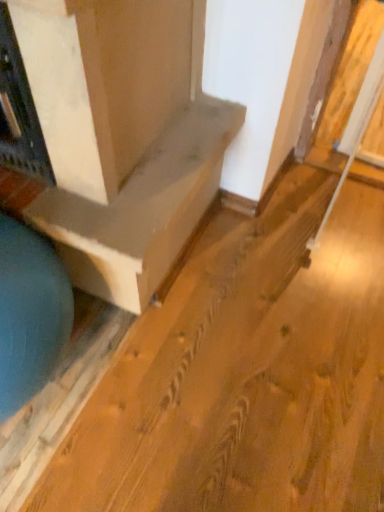
The image size is (384, 512). What do you see at coordinates (123, 135) in the screenshot?
I see `smooth concrete bench at center` at bounding box center [123, 135].

Locate an element on the screen. The image size is (384, 512). smooth concrete bench at center is located at coordinates (123, 135).

You are a GUI agent. You are given a task and a screenshot of the screen. Output one action in this format:
    pyautogui.click(x=<x>, y=<y>)
    Task: Click on the smooth concrete bench at center
    The image size is (384, 512).
    Given the screenshot: What is the action you would take?
    pyautogui.click(x=123, y=135)